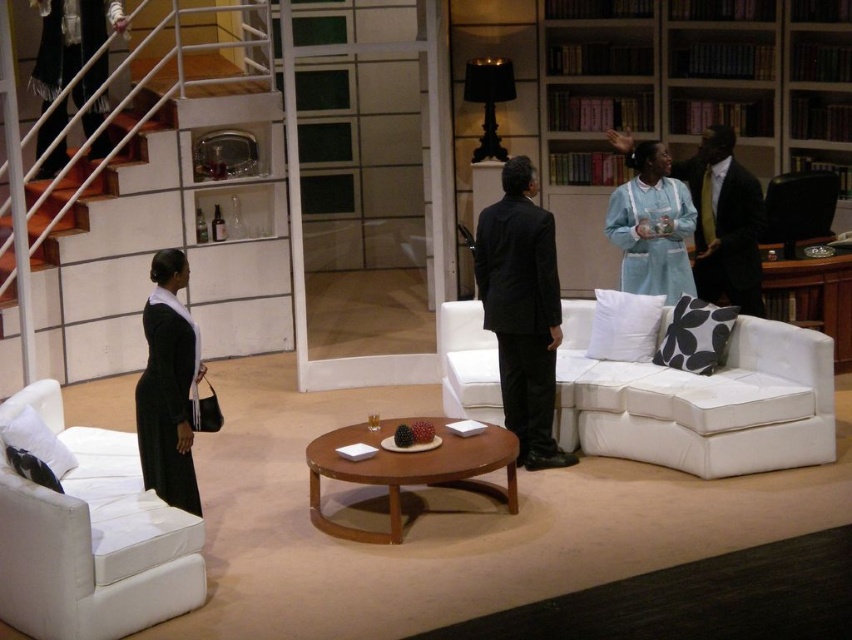
You are an actor preparing to perform on stage. You need to place a prop that is 1.2 meters wide on the stage. The prop must be placed on either the brown wooden coffee table at center or the dark blue satin business suit at right. Which object can accommodate the prop based on their sizes?

The brown wooden coffee table at center is bigger than the dark blue satin business suit at right, so the prop should be placed on the brown wooden coffee table at center as it can accommodate the 1.2 meters wide prop.

You are an actor in a play and need to move from the brown wooden coffee table at center to the dark blue satin business suit at right during a scene. Which direction should you move to reach the suit?

The brown wooden coffee table at center is positioned on the left side of the dark blue satin business suit at right, so you should move to the right to reach the suit.